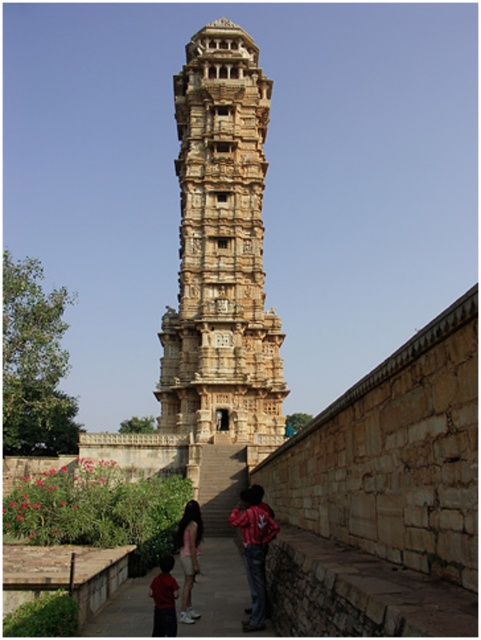
Question: Can you confirm if stone carved tower at center is positioned below red and white textured shirt at center?

Choices:
 (A) no
 (B) yes

Answer: (A)

Question: Which of these objects is positioned closest to the stone carved tower at center?

Choices:
 (A) matte red shirt at lower center
 (B) light pink fabric at lower center
 (C) red and white textured shirt at center

Answer: (C)

Question: Does red and white textured shirt at center have a larger size compared to matte red shirt at lower center?

Choices:
 (A) yes
 (B) no

Answer: (A)

Question: Is stone carved tower at center above light pink fabric at lower center?

Choices:
 (A) yes
 (B) no

Answer: (A)

Question: Which point is closer to the camera taking this photo?

Choices:
 (A) (179, 616)
 (B) (154, 636)
 (C) (267, 508)
 (D) (265, 353)

Answer: (B)

Question: Which point is farther from the camera taking this photo?

Choices:
 (A) (190, 529)
 (B) (172, 413)
 (C) (255, 598)
 (D) (174, 586)

Answer: (B)